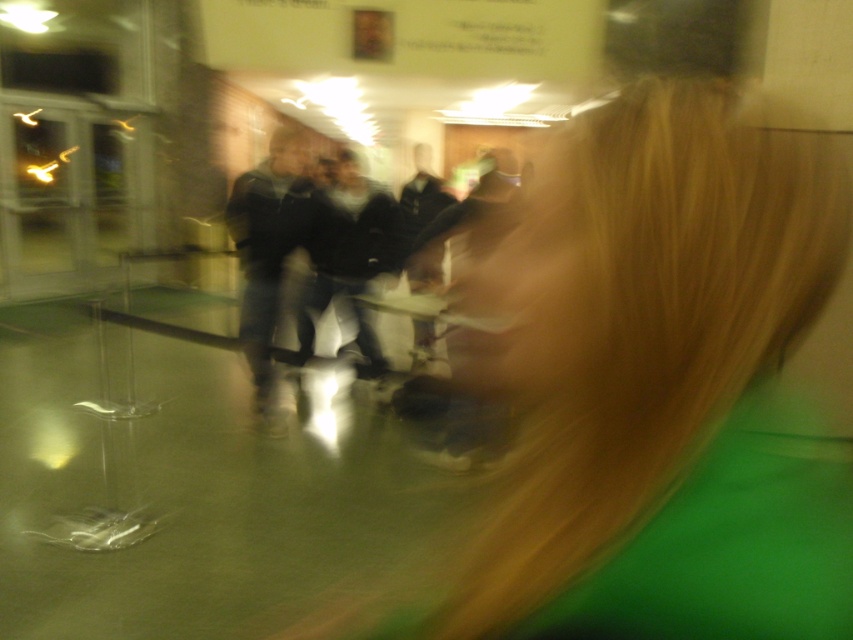
Is blonde hair at center taller than dark gray jacket at center?

Incorrect, blonde hair at center's height is not larger of dark gray jacket at center's.

Is blonde hair at center smaller than dark gray jacket at center?

Indeed, blonde hair at center has a smaller size compared to dark gray jacket at center.

Where is `blonde hair at center`? The width and height of the screenshot is (853, 640). blonde hair at center is located at coordinates (660, 387).